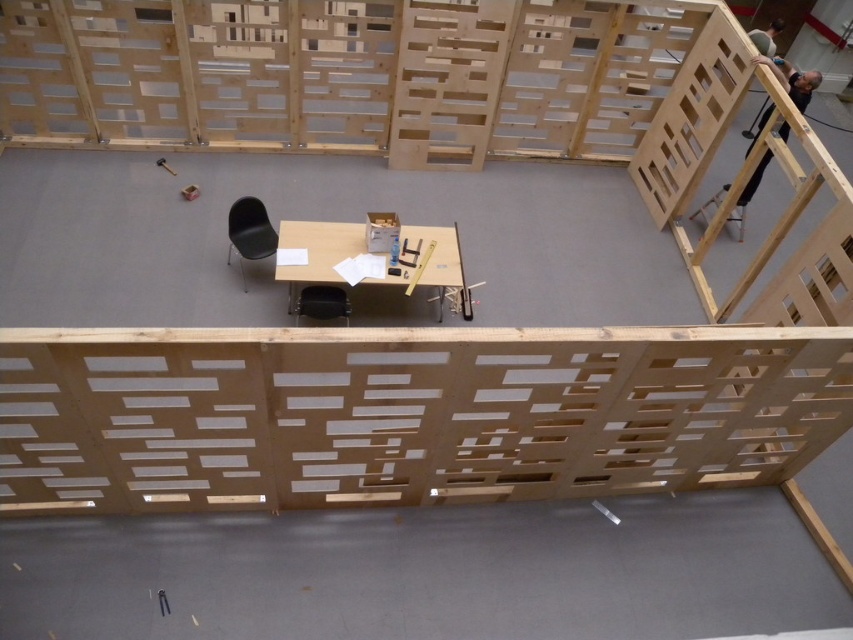
You are a worker in the construction area and need to move the black plastic chair at center to the other side of the matte brown table at center. Which direction should you move it?

The matte brown table at center is located above the black plastic chair at center, so you should move the black plastic chair at center downward to place it on the other side of the table.

You are organizing a small meeting in this workspace and need to ensure there is enough space between the matte brown table at center and the black plastic chair at center for people to walk comfortably. Based on their sizes, can you confirm if the space between them is sufficient?

The matte brown table at center is wider than the black plastic chair at center, but the description does not provide specific measurements for the distance between them. Therefore, it is unclear if the space is sufficient for comfortable walking.

You are an interior designer planning to place a new rectangular sofa in this workspace. The sofa is 1.2 meters wide. You need to decide between placing it next to the black matte chair at center or the black plastic chair at center. Based on the chairs widths, which chair should the sofa be placed next to to ensure a proper fit?

The black matte chair at center is thinner than the black plastic chair at center. To ensure the sofa fits properly, it should be placed next to the black plastic chair at center since its wider width will provide more space for the sofa.